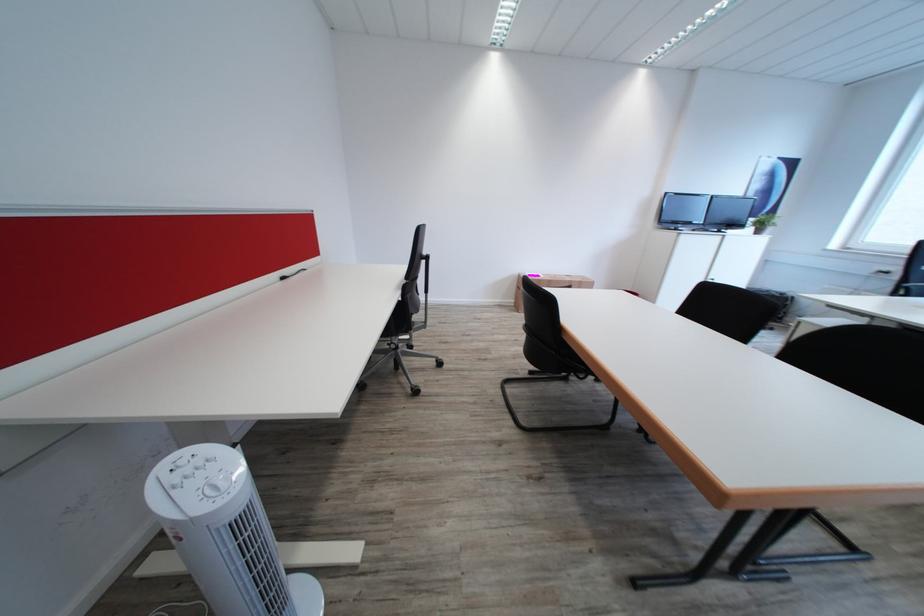
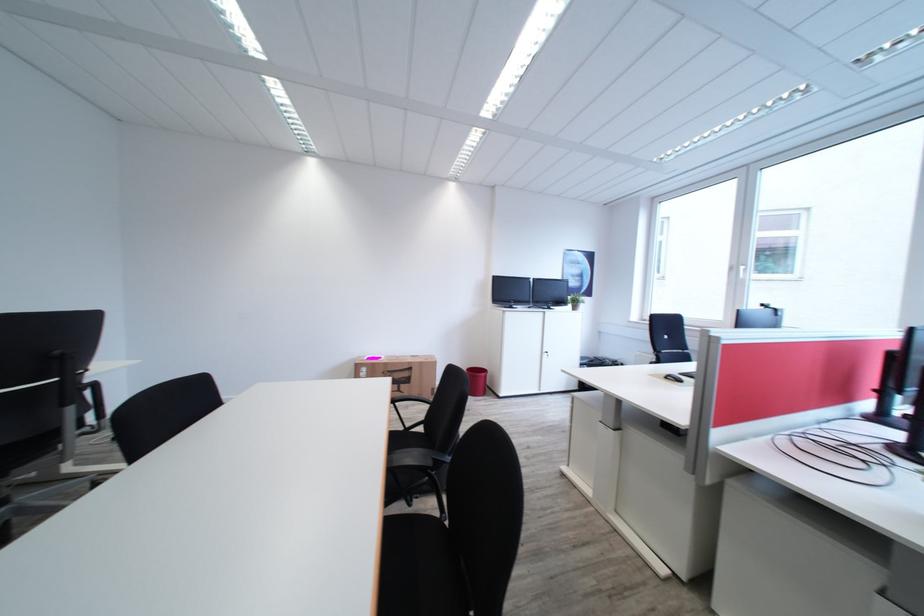
Question: Which direction would the cameraman need to move to produce the second image? Reply with the corresponding letter.

Choices:
 (A) Left
 (B) Right
 (C) Forward
 (D) Backward

Answer: (B)